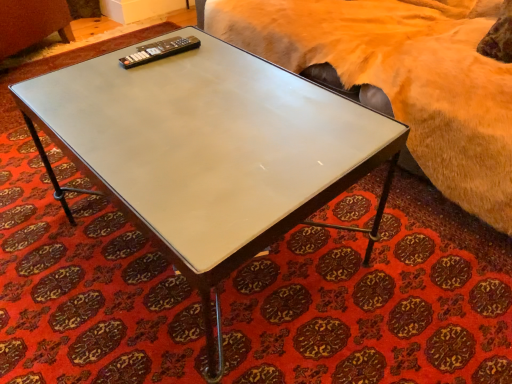
Question: Is black plastic remote at upper left located within fuzzy beige bed at upper right?

Choices:
 (A) no
 (B) yes

Answer: (A)

Question: Is fuzzy beige bed at upper right oriented away from black plastic remote at upper left?

Choices:
 (A) no
 (B) yes

Answer: (A)

Question: Does fuzzy beige bed at upper right appear on the left side of black plastic remote at upper left?

Choices:
 (A) yes
 (B) no

Answer: (B)

Question: Does fuzzy beige bed at upper right have a lesser height compared to black plastic remote at upper left?

Choices:
 (A) yes
 (B) no

Answer: (B)

Question: From a real-world perspective, is fuzzy beige bed at upper right physically above black plastic remote at upper left?

Choices:
 (A) yes
 (B) no

Answer: (B)

Question: Is there a large distance between fuzzy beige bed at upper right and black plastic remote at upper left?

Choices:
 (A) yes
 (B) no

Answer: (B)

Question: Is white glossy coffee table at center wider than fuzzy beige bed at upper right?

Choices:
 (A) yes
 (B) no

Answer: (B)

Question: Does white glossy coffee table at center have a smaller size compared to fuzzy beige bed at upper right?

Choices:
 (A) yes
 (B) no

Answer: (A)

Question: From a real-world perspective, does white glossy coffee table at center sit lower than fuzzy beige bed at upper right?

Choices:
 (A) yes
 (B) no

Answer: (A)

Question: Would you consider white glossy coffee table at center to be distant from fuzzy beige bed at upper right?

Choices:
 (A) no
 (B) yes

Answer: (A)

Question: Is white glossy coffee table at center facing away from fuzzy beige bed at upper right?

Choices:
 (A) yes
 (B) no

Answer: (A)

Question: Does white glossy coffee table at center come behind fuzzy beige bed at upper right?

Choices:
 (A) no
 (B) yes

Answer: (A)

Question: Does black plastic remote at upper left appear on the right side of white glossy coffee table at center?

Choices:
 (A) yes
 (B) no

Answer: (B)